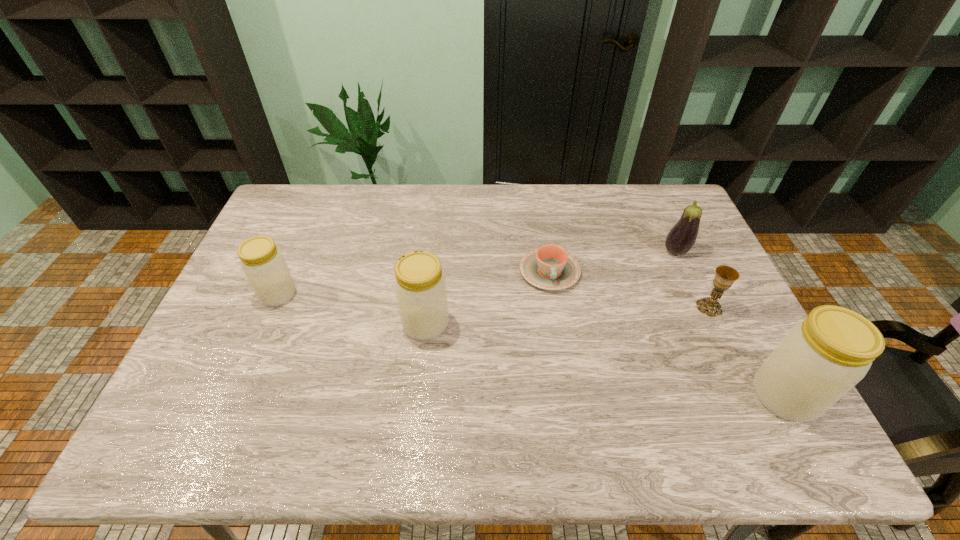
At what (x,y) coordinates should I click in order to perform the action: click on free space between the second jar from left to right and the rightmost jar. Please return your answer as a coordinate pair (x, y). Looking at the image, I should click on (605, 360).

Identify the location of vacant point located between the chalice and the leftmost object. (493, 301).

Where is `empty space that is in between the third object from left to right and the eggplant`? The width and height of the screenshot is (960, 540). empty space that is in between the third object from left to right and the eggplant is located at coordinates (612, 261).

Identify the location of unoccupied position between the nearest object and the chalice. (747, 352).

Identify the location of vacant space that is in between the eggplant and the fifth tallest object. Image resolution: width=960 pixels, height=540 pixels. (692, 279).

The image size is (960, 540). What are the coordinates of `vacant point located between the leftmost jar and the chalice` in the screenshot? It's located at (493, 301).

Locate an element on the screen. This screenshot has width=960, height=540. vacant region between the second object from left to right and the shortest object is located at coordinates (488, 298).

Select which object is the third closest to the second object from left to right. Please provide its 2D coordinates. Your answer should be formatted as a tuple, i.e. [(x, y)], where the tuple contains the x and y coordinates of a point satisfying the conditions above.

[(681, 238)]

In order to click on the fourth closest object to the nearest jar in this screenshot , I will do `click(420, 288)`.

The image size is (960, 540). In order to click on the second closest jar to the chalice in this screenshot , I will do `click(420, 288)`.